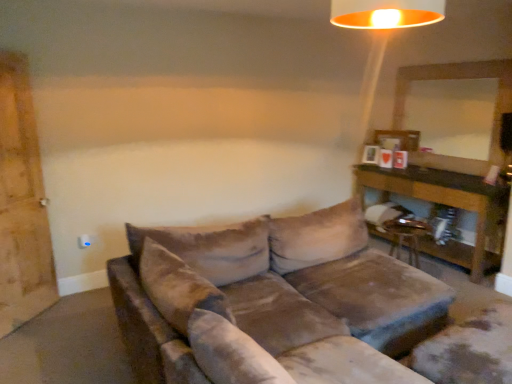
Question: Considering the relative sizes of metallic gold swivel chair at lower right and brown wooden table at right in the image provided, is metallic gold swivel chair at lower right smaller than brown wooden table at right?

Choices:
 (A) no
 (B) yes

Answer: (B)

Question: Is metallic gold swivel chair at lower right thinner than brown wooden table at right?

Choices:
 (A) yes
 (B) no

Answer: (A)

Question: Is metallic gold swivel chair at lower right completely or partially outside of brown wooden table at right?

Choices:
 (A) yes
 (B) no

Answer: (A)

Question: From a real-world perspective, is metallic gold swivel chair at lower right located beneath brown wooden table at right?

Choices:
 (A) yes
 (B) no

Answer: (A)

Question: Is there a large distance between metallic gold swivel chair at lower right and brown wooden table at right?

Choices:
 (A) yes
 (B) no

Answer: (B)

Question: From the image's perspective, relative to brown wooden table at right, is metallic gold lampshade at upper center above or below?

Choices:
 (A) below
 (B) above

Answer: (B)

Question: From a real-world perspective, relative to brown wooden table at right, is metallic gold lampshade at upper center vertically above or below?

Choices:
 (A) above
 (B) below

Answer: (A)

Question: Would you say metallic gold lampshade at upper center is to the left or to the right of brown wooden table at right in the picture?

Choices:
 (A) right
 (B) left

Answer: (B)

Question: Considering the positions of metallic gold lampshade at upper center and brown wooden table at right in the image, is metallic gold lampshade at upper center taller or shorter than brown wooden table at right?

Choices:
 (A) short
 (B) tall

Answer: (A)

Question: In the image, is velvet brown couch at center positioned in front of or behind wooden barn door at left?

Choices:
 (A) front
 (B) behind

Answer: (A)

Question: From their relative heights in the image, would you say velvet brown couch at center is taller or shorter than wooden barn door at left?

Choices:
 (A) tall
 (B) short

Answer: (B)

Question: Is velvet brown couch at center situated inside wooden barn door at left or outside?

Choices:
 (A) outside
 (B) inside

Answer: (A)

Question: Is point (206, 246) closer or farther from the camera than point (25, 107)?

Choices:
 (A) closer
 (B) farther

Answer: (A)

Question: In terms of width, does metallic gold swivel chair at lower right look wider or thinner when compared to brown wooden table at right?

Choices:
 (A) thin
 (B) wide

Answer: (A)

Question: Visually, is metallic gold swivel chair at lower right positioned to the left or to the right of brown wooden table at right?

Choices:
 (A) left
 (B) right

Answer: (A)